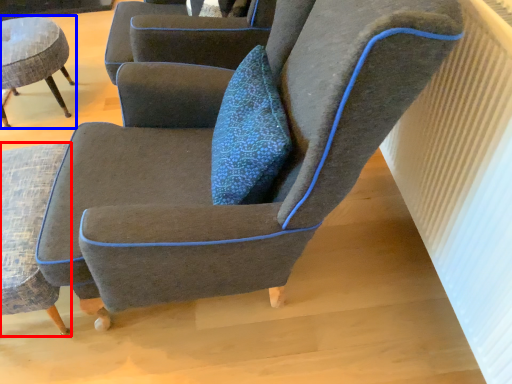
Question: Which of the following is the closest to the observer, chair (highlighted by a red box) or chair (highlighted by a blue box)?

Choices:
 (A) chair
 (B) chair

Answer: (A)